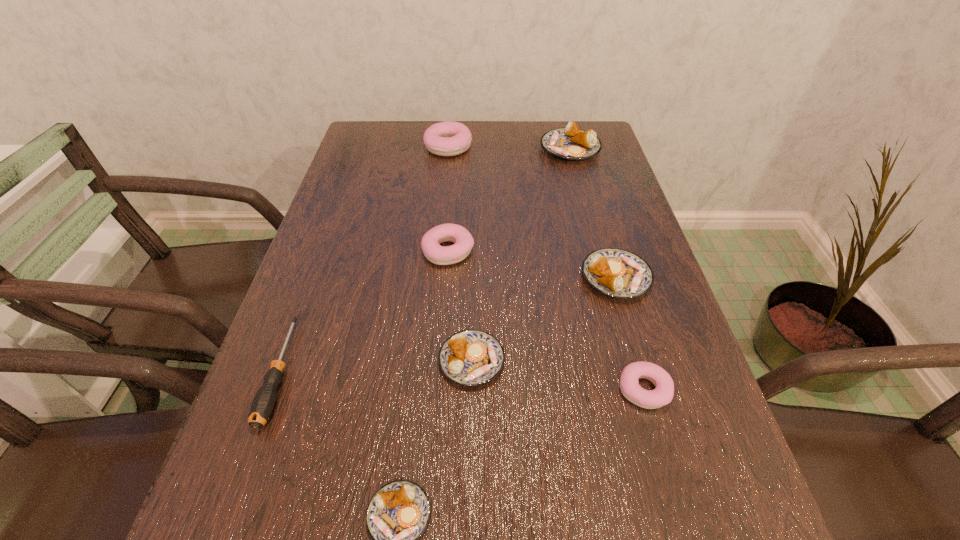
In order to click on vacant space at the far left corner in this screenshot , I will do `click(365, 131)`.

Image resolution: width=960 pixels, height=540 pixels. Identify the location of free spot at the far right corner of the desktop. (578, 127).

I want to click on free space between the third biggest brown pastry and the smallest pink pastry, so pyautogui.click(x=558, y=375).

Locate an element on the screen. This screenshot has height=540, width=960. empty space that is in between the second farthest pink pastry and the third smallest brown pastry is located at coordinates pos(532,264).

Find the location of a particular element. free space between the third smallest brown pastry and the leftmost object is located at coordinates (448, 325).

Identify the location of unoccupied position between the biggest pink pastry and the screwdriver. (365, 259).

Locate an element on the screen. The image size is (960, 540). object that can be found as the second closest to the nearest pink pastry is located at coordinates (470, 357).

Locate which object is the second closest to the biggest pink pastry. Please provide its 2D coordinates. Your answer should be formatted as a tuple, i.e. [(x, y)], where the tuple contains the x and y coordinates of a point satisfying the conditions above.

[(434, 252)]

Find the location of `pastry identified as the closest to the third farthest brown pastry`. pastry identified as the closest to the third farthest brown pastry is located at coordinates (398, 513).

Identify which pastry is the third nearest to the farthest pink pastry. Please provide its 2D coordinates. Your answer should be formatted as a tuple, i.e. [(x, y)], where the tuple contains the x and y coordinates of a point satisfying the conditions above.

[(618, 273)]